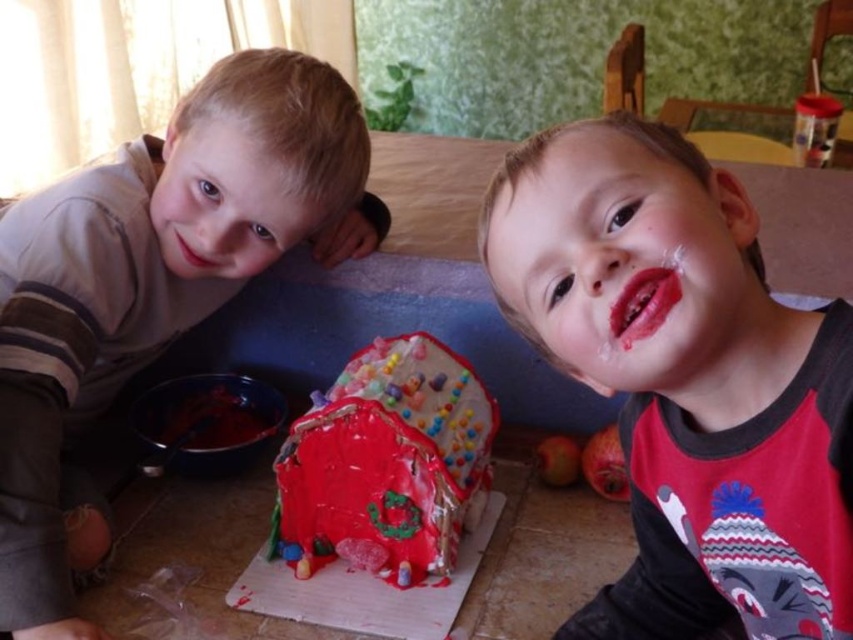
Question: Is shiny red gingerbread house at center above smooth skin face at upper left?

Choices:
 (A) no
 (B) yes

Answer: (A)

Question: Which point is closer to the camera?

Choices:
 (A) (258, 212)
 (B) (552, 220)
 (C) (556, 128)

Answer: (B)

Question: Which object is farther from the camera taking this photo?

Choices:
 (A) glossy plastic face at center
 (B) matte gray sweater at left
 (C) matte red shirt at center

Answer: (B)

Question: Is matte red shirt at center positioned at the back of matte gray sweater at left?

Choices:
 (A) no
 (B) yes

Answer: (A)

Question: Which point is farther from the camera taking this photo?

Choices:
 (A) (540, 182)
 (B) (415, 460)

Answer: (B)

Question: Where is matte gray sweater at left located in relation to glossy plastic face at center in the image?

Choices:
 (A) left
 (B) right

Answer: (A)